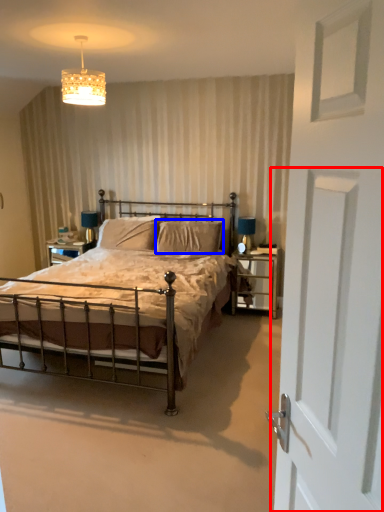
Question: Among these objects, which one is farthest to the camera, screen door (highlighted by a red box) or pillow (highlighted by a blue box)?

Choices:
 (A) screen door
 (B) pillow

Answer: (B)